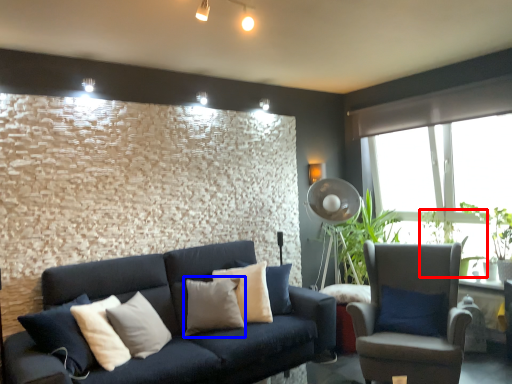
Question: Which point is further to the camera, plant (highlighted by a red box) or pillow (highlighted by a blue box)?

Choices:
 (A) plant
 (B) pillow

Answer: (A)